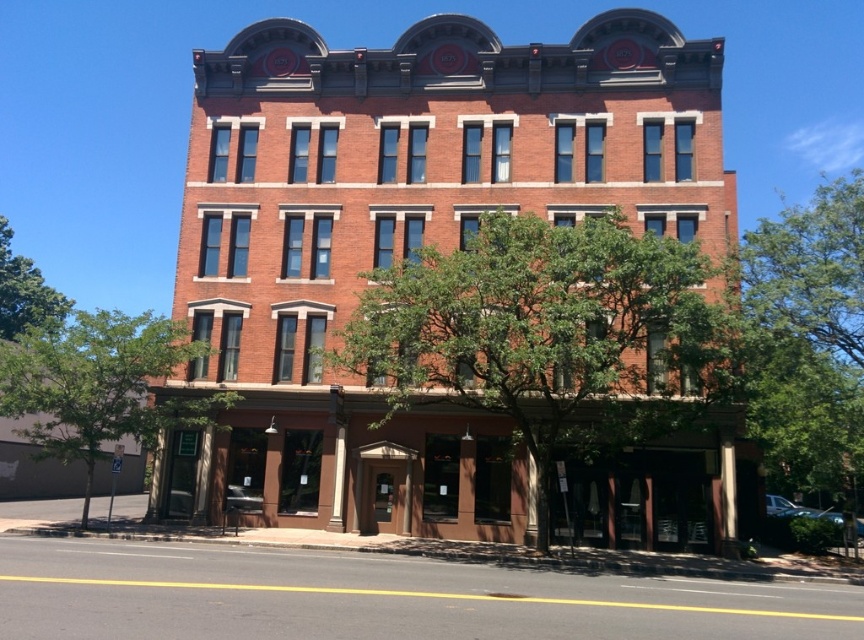
You are standing in front of the three story brick building and notice two green leafy trees. Which tree, the green leafy tree at center or the green leafy tree at left, appears smaller in size?

The green leafy tree at center has a smaller size compared to the green leafy tree at left.

You are a city planner assessing the building for potential solar panel installation. You notice two green leafy trees in the image. Which tree, the green leafy tree at upper right or the green leafy tree at left, might cast a wider shadow on the building during midday? Please explain your reasoning based on their positions and sizes.

The green leafy tree at upper right has a greater width than the green leafy tree at left, so it would cast a wider shadow on the building during midday.